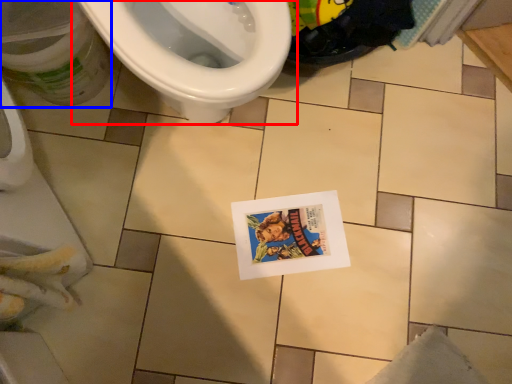
Question: Which object appears farthest to the camera in this image, toilet (highlighted by a red box) or potty (highlighted by a blue box)?

Choices:
 (A) toilet
 (B) potty

Answer: (B)